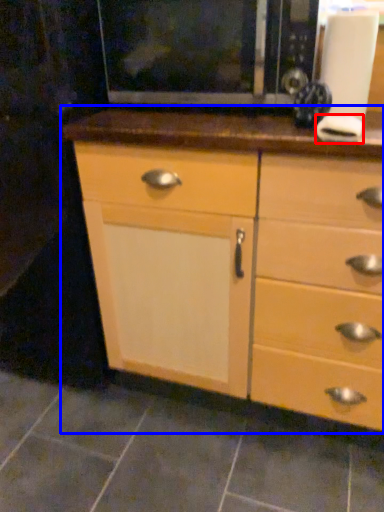
Question: Which point is closer to the camera, knob (highlighted by a red box) or chest of drawers (highlighted by a blue box)?

Choices:
 (A) knob
 (B) chest of drawers

Answer: (B)